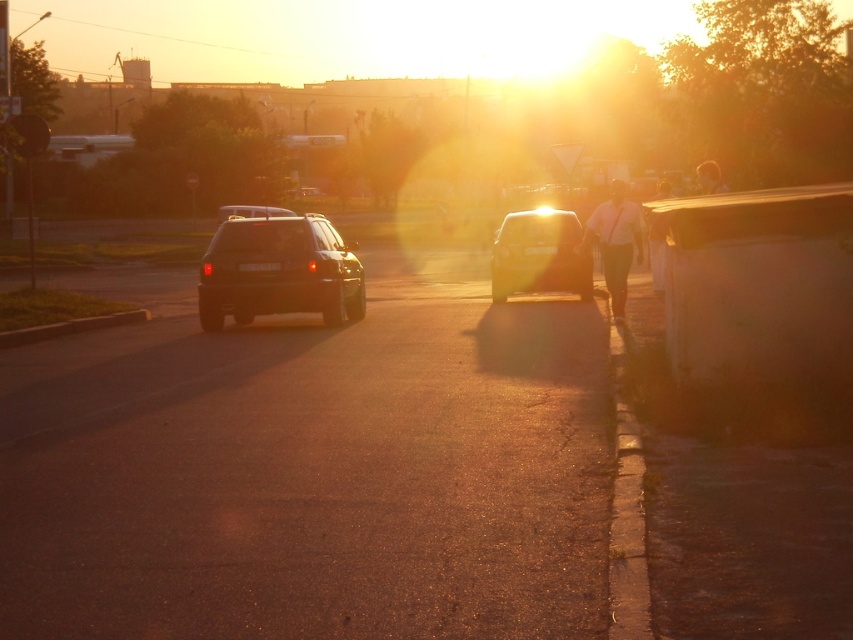
You are driving a car and see two points on the road ahead. The first point is at coordinates point (664, 248) and the second is at point (236, 211). Which point is closer to your current position?

Point (664, 248) is in front of point (236, 211), so the closer point to your current position is point (236, 211).

You are driving a car and see two points on the road ahead. The first point is at coordinates point (648, 228) and the second is at point (704, 193). Based on the scene, which point is closer to your current position?

Point (648, 228) is in front of point (704, 193), so the first point is closer to your current position.

You are standing at the camera position and want to walk to the point at coordinates point (613, 188) and then to point (219, 218). Which point should you visit first to minimize the total distance walked?

You should visit point (613, 188) first because it is closer to the camera than point (219, 218), so going there first minimizes the total distance walked.